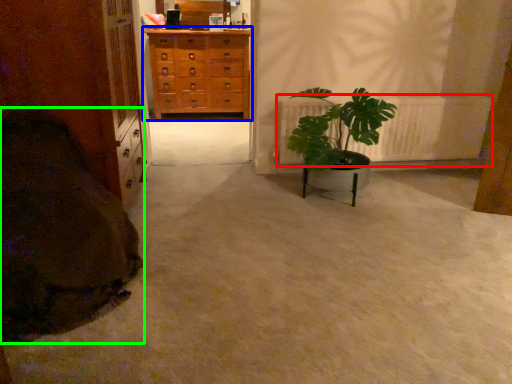
Question: Which object is the farthest from radiator (highlighted by a red box)? Choose among these: chest of drawers (highlighted by a blue box) or blanket (highlighted by a green box).

Choices:
 (A) chest of drawers
 (B) blanket

Answer: (A)